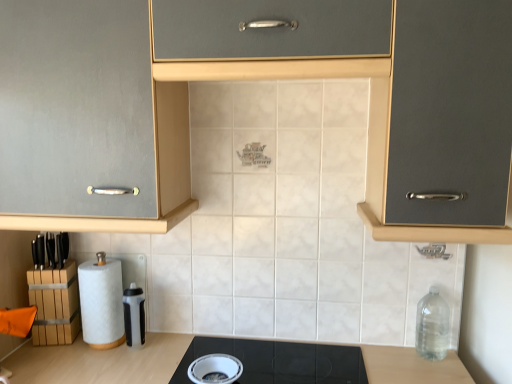
You are a GUI agent. You are given a task and a screenshot of the screen. Output one action in this format:
    pyautogui.click(x=<x>, y=<y>)
    Task: Click on the free space above white glossy bowl at lower center, which is the 2th appliance in top-to-bottom order (from a real-world perspective)
    
    Given the screenshot: What is the action you would take?
    pyautogui.click(x=218, y=363)